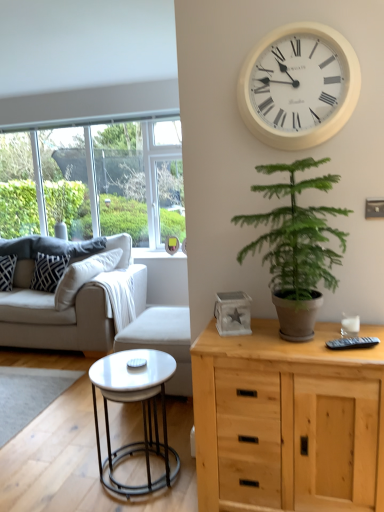
You are a GUI agent. You are given a task and a screenshot of the screen. Output one action in this format:
    pyautogui.click(x=<x>, y=<y>)
    Task: Click on the free region on the left part of white glossy coffee table at lower left
    The width and height of the screenshot is (384, 512).
    Given the screenshot: What is the action you would take?
    pyautogui.click(x=62, y=469)